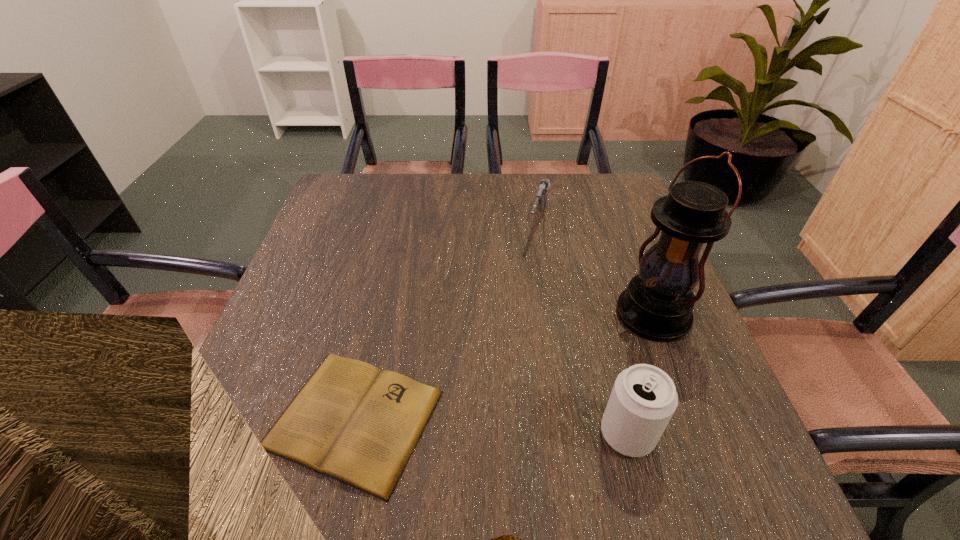
Where is `unoccupied area between the lantern and the gun`? The height and width of the screenshot is (540, 960). unoccupied area between the lantern and the gun is located at coordinates (595, 269).

Where is `free spot between the leftmost object and the lantern`? This screenshot has height=540, width=960. free spot between the leftmost object and the lantern is located at coordinates (503, 367).

Where is `free spot between the second tallest object and the farthest object`? The image size is (960, 540). free spot between the second tallest object and the farthest object is located at coordinates (583, 328).

Find the location of a particular element. Image resolution: width=960 pixels, height=540 pixels. unoccupied area between the can and the gun is located at coordinates (583, 328).

This screenshot has width=960, height=540. Find the location of `empty space between the shortest object and the tallest object`. empty space between the shortest object and the tallest object is located at coordinates (503, 367).

This screenshot has height=540, width=960. What are the coordinates of `free spot between the gun and the lantern` in the screenshot? It's located at (595, 269).

You are a GUI agent. You are given a task and a screenshot of the screen. Output one action in this format:
    pyautogui.click(x=<x>, y=<y>)
    Task: Click on the unoccupied position between the can and the leftmost object
    The height and width of the screenshot is (540, 960).
    Given the screenshot: What is the action you would take?
    pyautogui.click(x=491, y=426)

In order to click on free spot between the second tallest object and the second shortest object in this screenshot , I will do `click(583, 328)`.

Identify the location of the second closest object to the book. The width and height of the screenshot is (960, 540). (657, 305).

In order to click on object that can be found as the second closest to the book in this screenshot , I will do `click(657, 305)`.